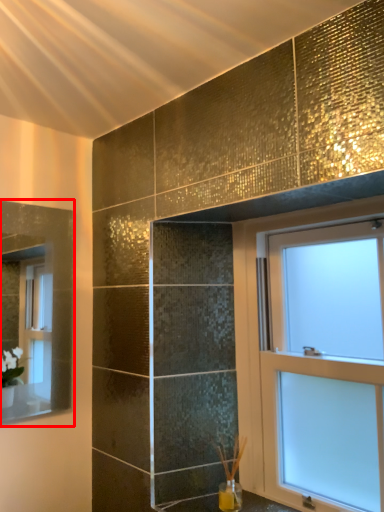
Question: From the image's perspective, where is mirror (annotated by the red box) located relative to window?

Choices:
 (A) below
 (B) above

Answer: (B)